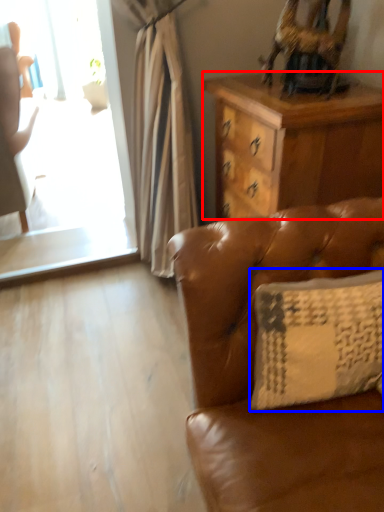
Question: Which of the following is the closest to the observer, desk (highlighted by a red box) or pillow (highlighted by a blue box)?

Choices:
 (A) desk
 (B) pillow

Answer: (B)